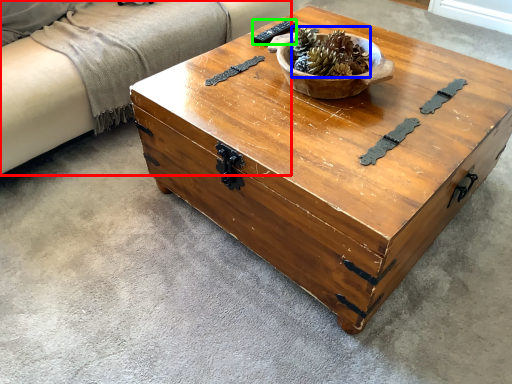
Question: Which is farther away from couch (highlighted by a red box)? centerpiece (highlighted by a blue box) or remote (highlighted by a green box)?

Choices:
 (A) centerpiece
 (B) remote

Answer: (A)